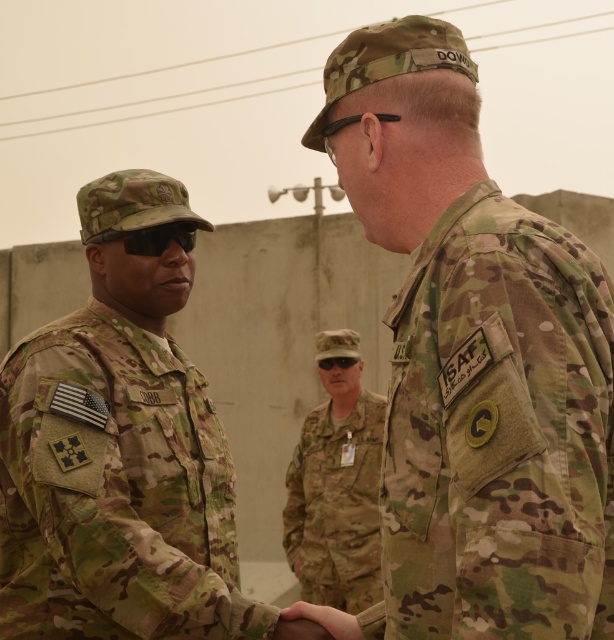
Is camouflage uniform at center taller than matte black goggles at center?

Yes, camouflage uniform at center is taller than matte black goggles at center.

In the scene shown: Can you confirm if camouflage uniform at center is smaller than matte black goggles at center?

Actually, camouflage uniform at center might be larger than matte black goggles at center.

Is point (573, 499) behind point (336, 360)?

No.

At what (x,y) coordinates should I click in order to perform the action: click on camouflage uniform at center. Please return your answer as a coordinate pair (x, y). Looking at the image, I should click on (472, 362).

Which is more to the right, camo fabric uniform at center or matte black goggles at center?

matte black goggles at center

Between camo fabric uniform at center and matte black goggles at center, which one has less height?

matte black goggles at center is shorter.

This screenshot has height=640, width=614. Describe the element at coordinates (336, 506) in the screenshot. I see `camo fabric uniform at center` at that location.

This screenshot has width=614, height=640. Identify the location of camo fabric uniform at center. (336, 506).

Measure the distance between point [246,625] and camera.

4.71 meters

Does camouflage fabric uniform at left have a lesser width compared to black matte sunglasses at center?

No, camouflage fabric uniform at left is not thinner than black matte sunglasses at center.

Which is in front, point (68, 612) or point (193, 225)?

Positioned in front is point (68, 612).

Image resolution: width=614 pixels, height=640 pixels. Identify the location of camouflage fabric uniform at left. (114, 490).